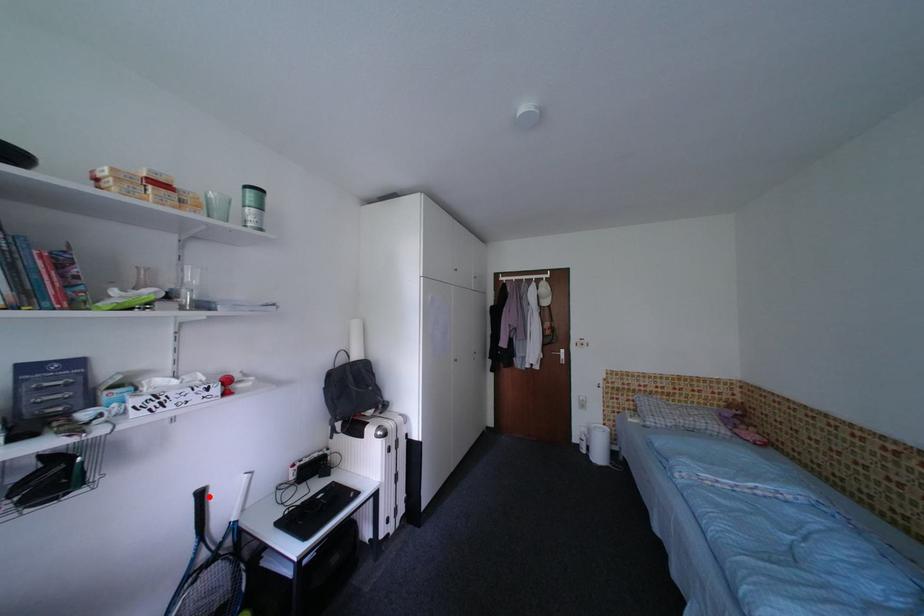
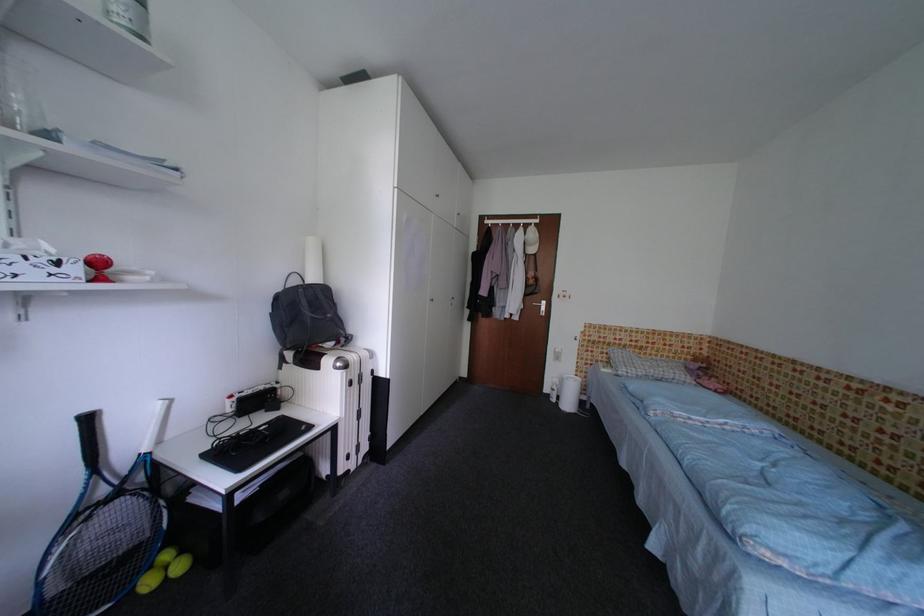
Where in the second image is the point corresponding to the highlighted location from the first image?

(98, 422)